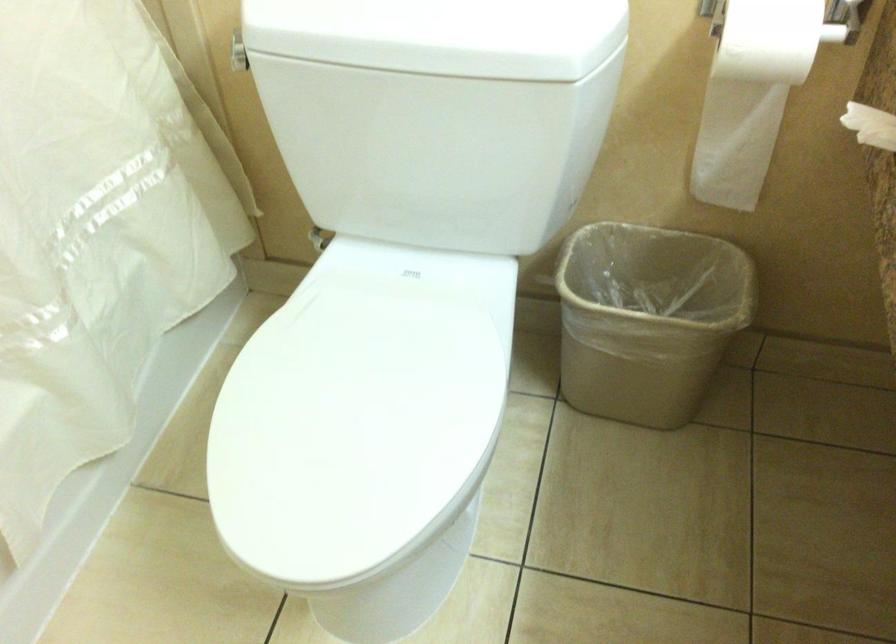
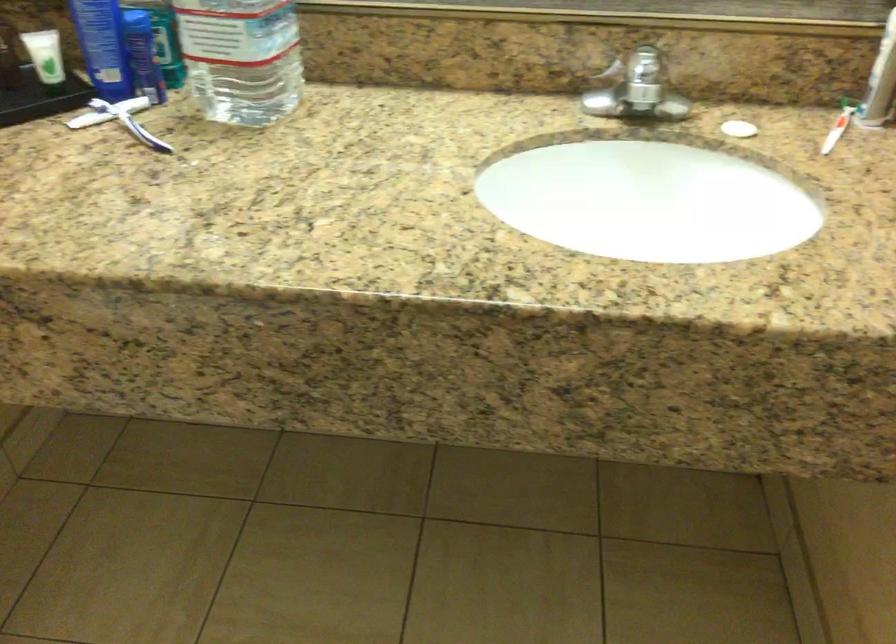
First-person continuous shooting, in which direction is the camera rotating?

The rotation direction of the camera is right-down.